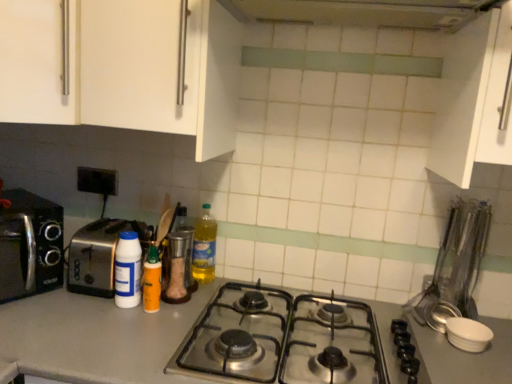
Where is `vacant area that is in front of metallic silver shaker at center`? The image size is (512, 384). vacant area that is in front of metallic silver shaker at center is located at coordinates (151, 317).